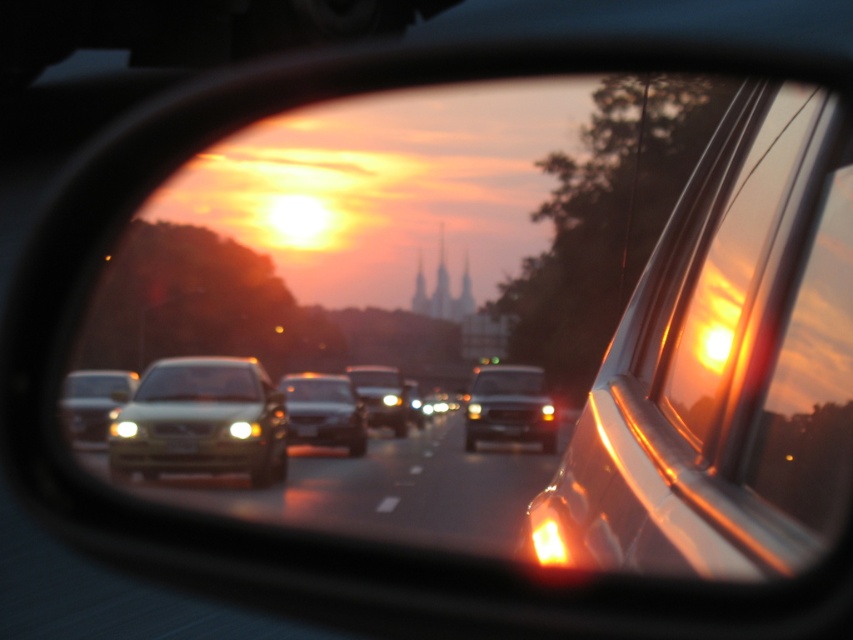
The height and width of the screenshot is (640, 853). In order to click on satin silver sedan at center in this screenshot , I will do `click(323, 412)`.

Who is more forward, (292,413) or (79,420)?

Point (79,420) is more forward.

At what (x,y) coordinates should I click in order to perform the action: click on satin silver sedan at center. Please return your answer as a coordinate pair (x, y). The height and width of the screenshot is (640, 853). Looking at the image, I should click on (323, 412).

You are a GUI agent. You are given a task and a screenshot of the screen. Output one action in this format:
    pyautogui.click(x=<x>, y=<y>)
    Task: Click on the satin silver sedan at center
    
    Given the screenshot: What is the action you would take?
    pyautogui.click(x=323, y=412)

Between point (252, 390) and point (84, 412), which one is positioned behind?

Positioned behind is point (84, 412).

This screenshot has width=853, height=640. What do you see at coordinates (201, 420) in the screenshot?
I see `satin gold sedan at center` at bounding box center [201, 420].

Is point (270, 480) less distant than point (109, 404)?

Yes, point (270, 480) is closer to viewer.

Find the location of a particular element. satin gold sedan at center is located at coordinates (201, 420).

Is point (64, 394) closer to viewer compared to point (184, 451)?

No, it is behind (184, 451).

Locate an element on the screen. The width and height of the screenshot is (853, 640). matte silver van at left is located at coordinates (93, 403).

The image size is (853, 640). I want to click on matte silver van at left, so click(x=93, y=403).